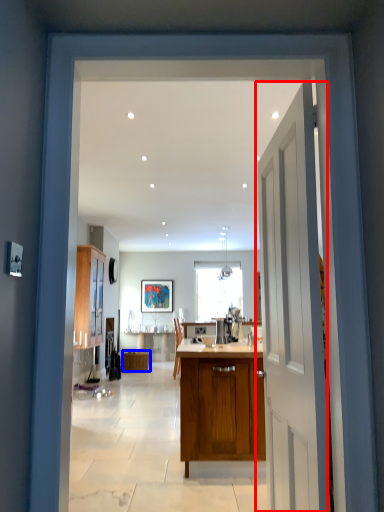
Question: Which object is further to the camera taking this photo, door (highlighted by a red box) or cabinetry (highlighted by a blue box)?

Choices:
 (A) door
 (B) cabinetry

Answer: (B)